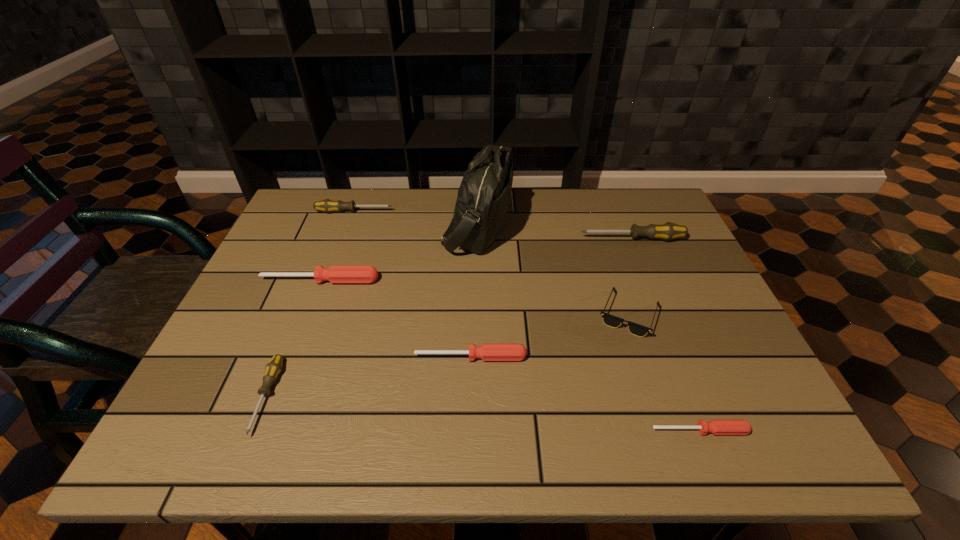
The height and width of the screenshot is (540, 960). Find the location of `shoulder bag`. shoulder bag is located at coordinates (483, 198).

Locate an element on the screen. Image resolution: width=960 pixels, height=540 pixels. the second tallest object is located at coordinates (667, 231).

Where is `the second nearest gray screwdriver`? Image resolution: width=960 pixels, height=540 pixels. the second nearest gray screwdriver is located at coordinates (667, 231).

What are the coordinates of `the farthest screwdriver` in the screenshot? It's located at pyautogui.click(x=327, y=205).

Where is `the farthest gray screwdriver`? This screenshot has width=960, height=540. the farthest gray screwdriver is located at coordinates (327, 205).

Where is `the fourth nearest screwdriver`? the fourth nearest screwdriver is located at coordinates (337, 274).

This screenshot has width=960, height=540. I want to click on the farthest red screwdriver, so click(337, 274).

I want to click on the fourth nearest object, so click(610, 320).

Locate an element on the screen. The width and height of the screenshot is (960, 540). black sunglasses is located at coordinates (610, 320).

The height and width of the screenshot is (540, 960). I want to click on the second farthest red screwdriver, so click(x=487, y=352).